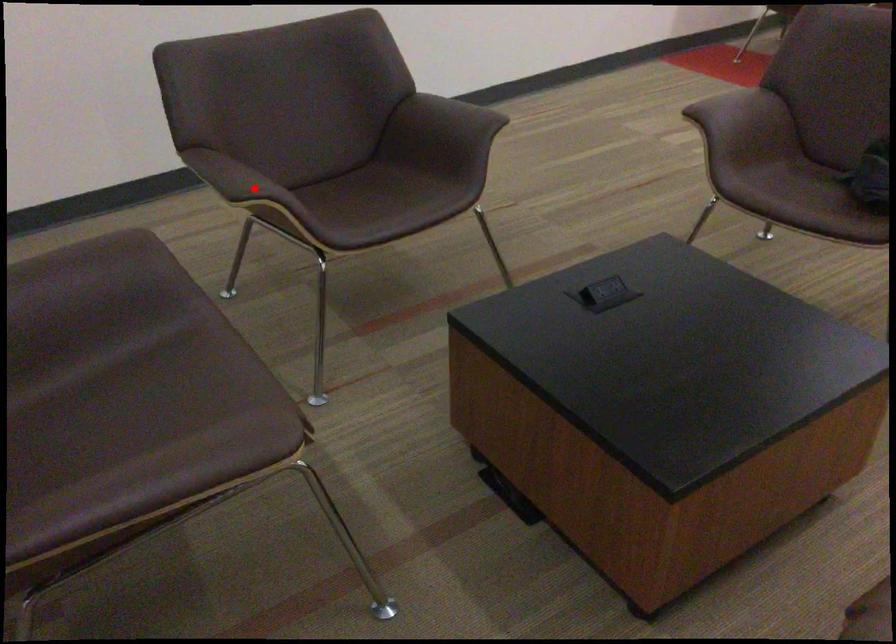
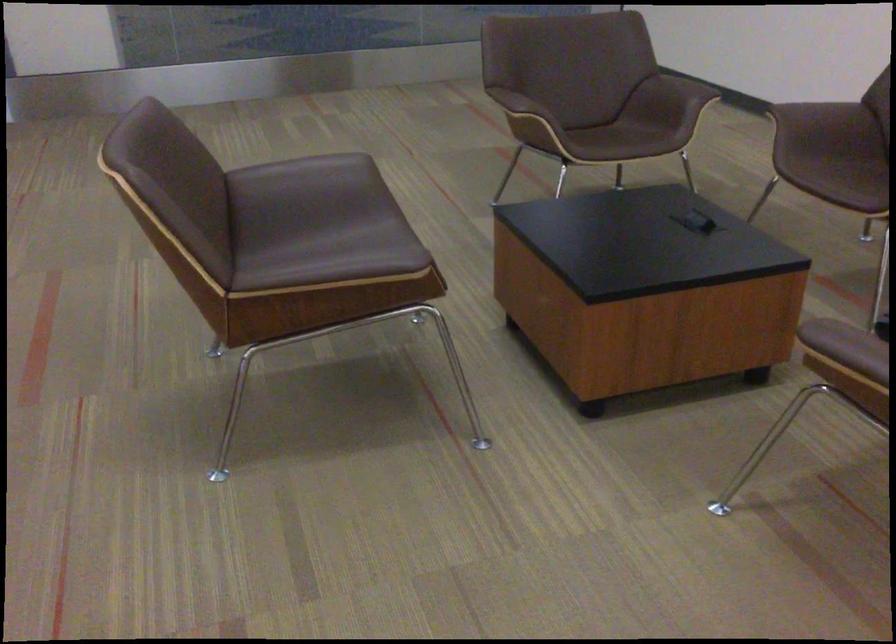
Question: I am providing you with two images of the same scene from different viewpoints. A red point is marked on the first image. Can you still see the location of the red point in image 2?

Choices:
 (A) Yes
 (B) No

Answer: (B)